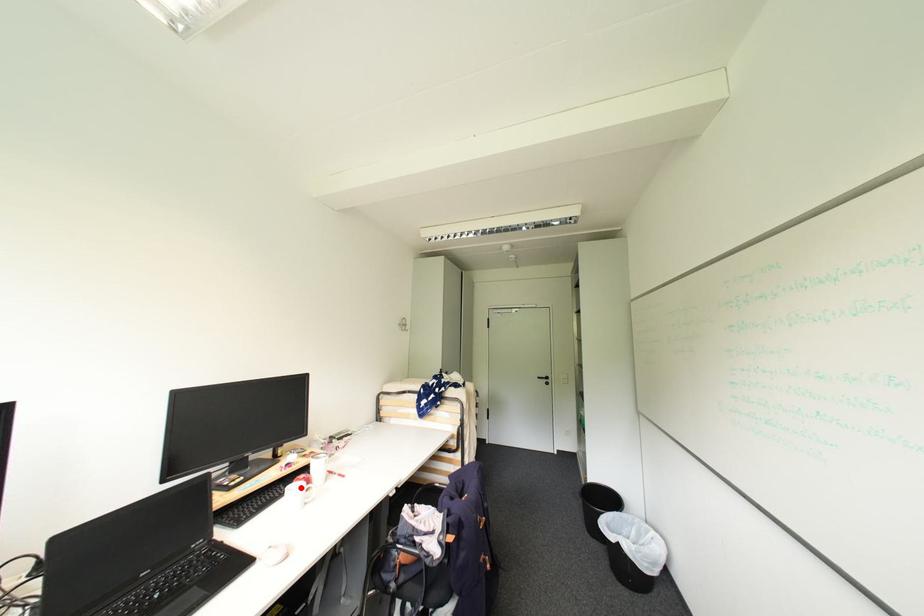
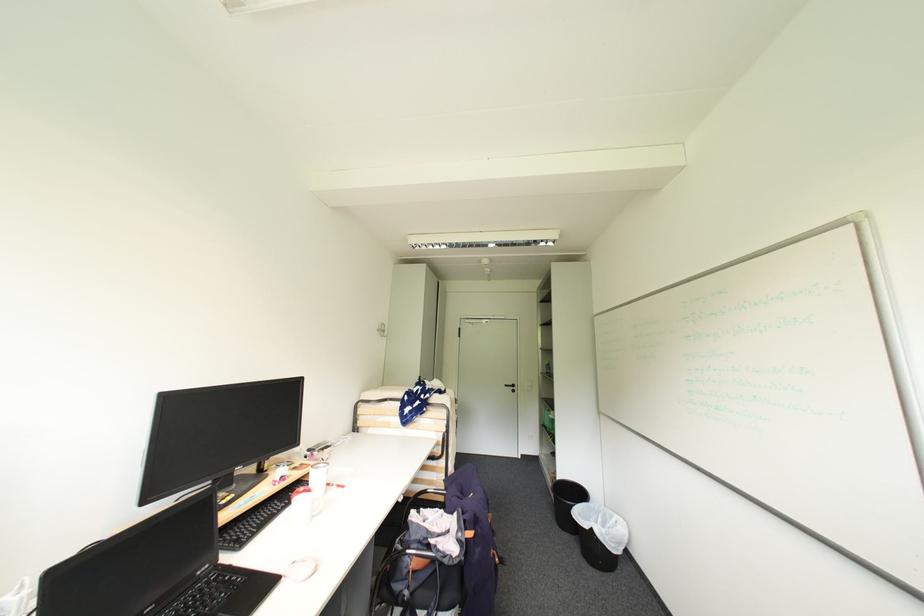
Find the pixel in the second image that matches the highlighted location in the first image.

(305, 501)